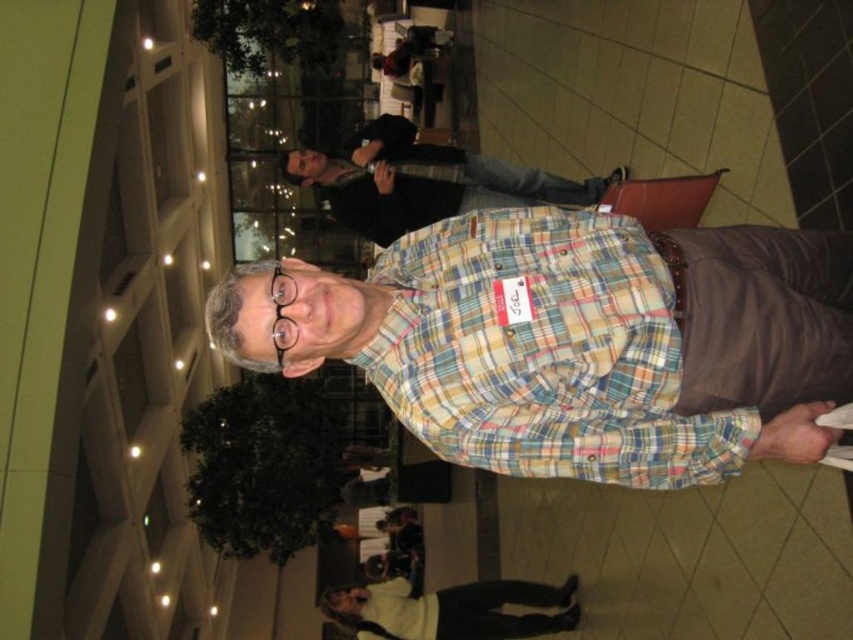
Question: Which of the following is the farthest from the observer?

Choices:
 (A) (683, 444)
 (B) (374, 584)

Answer: (B)

Question: Which object appears closest to the camera in this image?

Choices:
 (A) white fleece sweater at lower center
 (B) multicolored plaid shirt at center

Answer: (B)

Question: Does multicolored plaid shirt at center appear over white fleece sweater at lower center?

Choices:
 (A) yes
 (B) no

Answer: (A)

Question: Which point is farther from the camera taking this photo?

Choices:
 (A) (512, 618)
 (B) (721, 477)

Answer: (A)

Question: From the image, what is the correct spatial relationship of multicolored plaid shirt at center in relation to white fleece sweater at lower center?

Choices:
 (A) left
 (B) right

Answer: (B)

Question: Is multicolored plaid shirt at center positioned at the back of white fleece sweater at lower center?

Choices:
 (A) yes
 (B) no

Answer: (B)